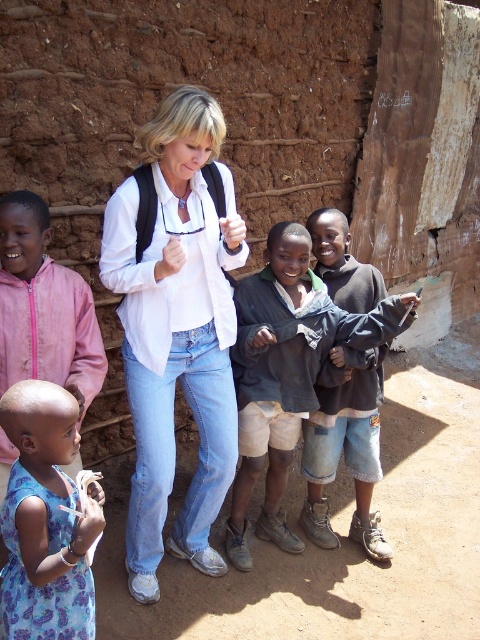
Between dark gray fabric jacket at center and blue floral dress at lower left, which one appears on the left side from the viewer's perspective?

From the viewer's perspective, blue floral dress at lower left appears more on the left side.

The width and height of the screenshot is (480, 640). What do you see at coordinates (285, 372) in the screenshot?
I see `dark gray fabric jacket at center` at bounding box center [285, 372].

Who is more distant from viewer, (284,458) or (24,600)?

Point (284,458)

Identify the location of dark gray fabric jacket at center. Image resolution: width=480 pixels, height=640 pixels. (285, 372).

Which is more to the right, blue floral dress at lower left or blue printed dress at lower left?

Positioned to the right is blue floral dress at lower left.

Who is more forward, (61, 476) or (7, 349)?

Point (61, 476)

At what (x,y) coordinates should I click in order to perform the action: click on blue floral dress at lower left. Please return your answer as a coordinate pair (x, y). Looking at the image, I should click on (45, 520).

Who is shorter, denim shorts at center or blue printed dress at lower left?

blue printed dress at lower left is shorter.

The width and height of the screenshot is (480, 640). What are the coordinates of `denim shorts at center` in the screenshot? It's located at (346, 451).